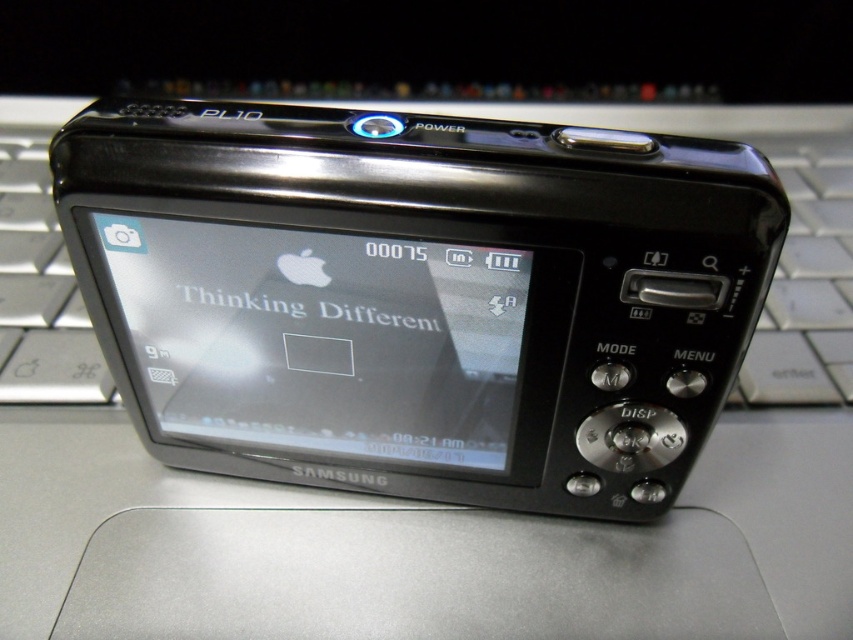
Is point (276, 332) positioned after point (30, 195)?

No.

Which is below, matte black screen at center or silver metallic keyboard at center?

matte black screen at center is lower down.

Does point (492, 452) come closer to viewer compared to point (814, 188)?

Yes, it is in front of point (814, 188).

Identify the location of matte black screen at center. This screenshot has height=640, width=853. (321, 339).